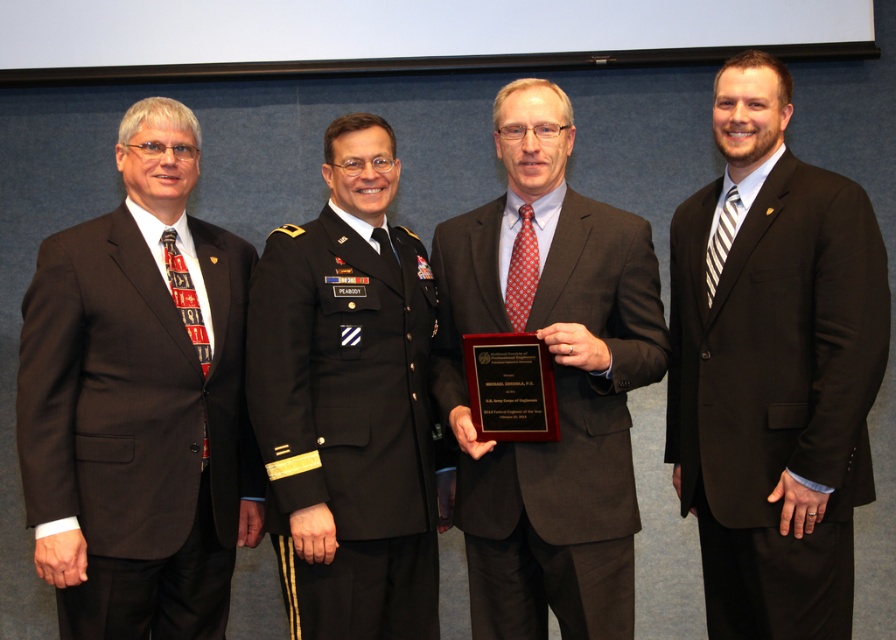
Question: In this image, where is black suit at right located relative to brown wool suit at left?

Choices:
 (A) above
 (B) below

Answer: (A)

Question: Which point is farther from the camera taking this photo?

Choices:
 (A) (597, 332)
 (B) (884, 276)

Answer: (A)

Question: Based on their relative distances, which object is farther from the black wool military uniform at center?

Choices:
 (A) black suit at right
 (B) matte black suit at center
 (C) brown wool suit at left

Answer: (A)

Question: Which object is the farthest from the black suit at right?

Choices:
 (A) matte black suit at center
 (B) brown wool suit at left
 (C) black wool military uniform at center

Answer: (B)

Question: Can you confirm if black wool military uniform at center is positioned to the right of matte black suit at center?

Choices:
 (A) no
 (B) yes

Answer: (A)

Question: Can you confirm if brown wool suit at left is positioned below matte black suit at center?

Choices:
 (A) no
 (B) yes

Answer: (B)